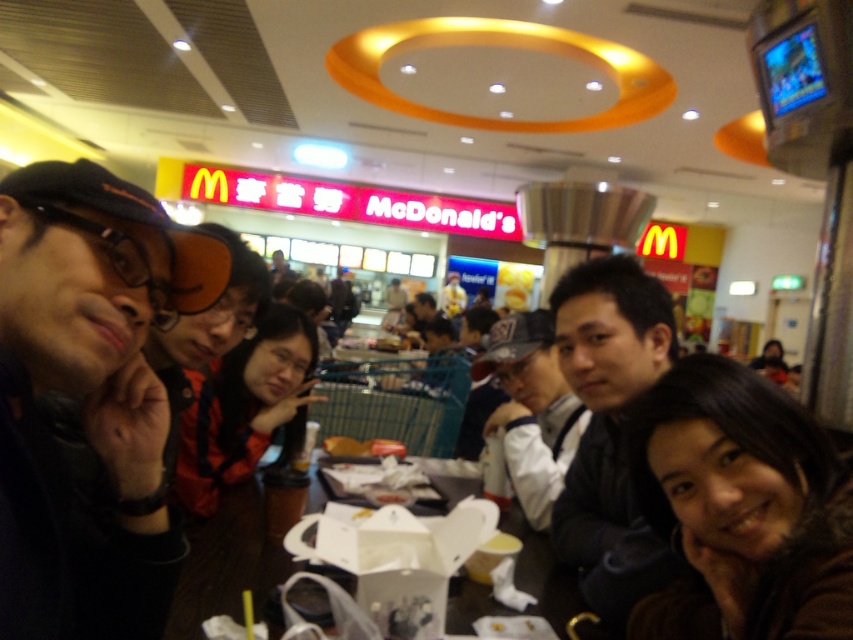
Question: Among these points, which one is nearest to the camera?

Choices:
 (A) (465, 486)
 (B) (601, 452)

Answer: (B)

Question: Which point is closer to the camera?

Choices:
 (A) (9, 566)
 (B) (598, 296)
 (C) (498, 467)
 (D) (193, 628)

Answer: (A)

Question: Which object appears farthest from the camera in this image?

Choices:
 (A) black matte jacket at center
 (B) black matte cap at upper left
 (C) matte black cap at center
 (D) wooden table at center

Answer: (C)

Question: Is black matte cap at upper left further to the viewer compared to wooden table at center?

Choices:
 (A) no
 (B) yes

Answer: (A)

Question: Can you confirm if black matte cap at upper left is thinner than matte black cap at center?

Choices:
 (A) no
 (B) yes

Answer: (B)

Question: In this image, where is black matte cap at upper left located relative to black matte jacket at center?

Choices:
 (A) left
 (B) right

Answer: (A)